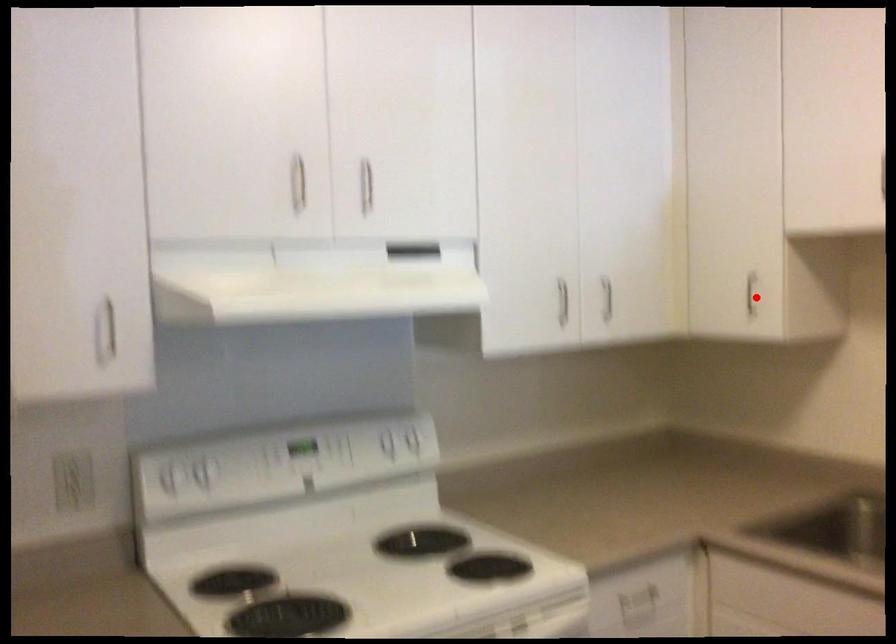
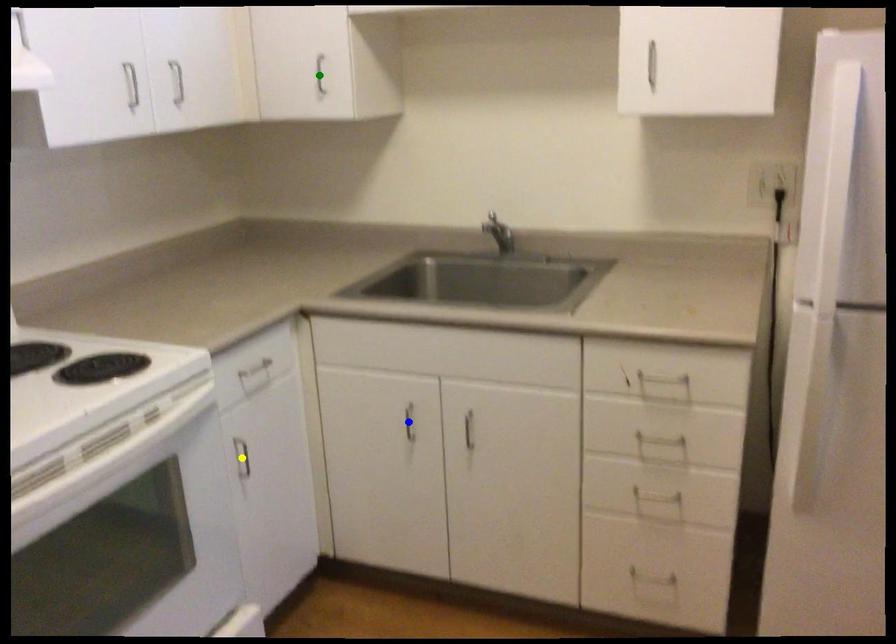
Question: I am providing you with two images of the same scene from different viewpoints. A red point is marked on the first image. You are given multiple points on the second image. Which mark in image 2 goes with the point in image 1?

Choices:
 (A) blue point
 (B) green point
 (C) yellow point

Answer: (B)